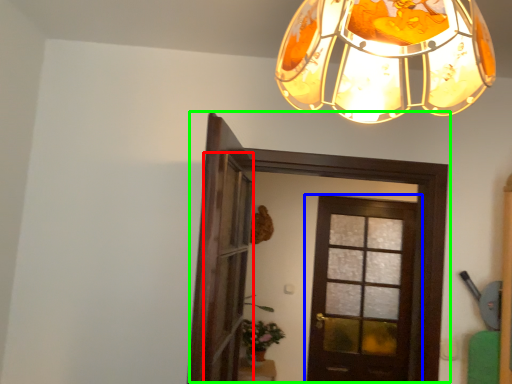
Question: Which object is positioned closest to screen door (highlighted by a red box)? Select from door (highlighted by a blue box) and door (highlighted by a green box).

Choices:
 (A) door
 (B) door

Answer: (B)